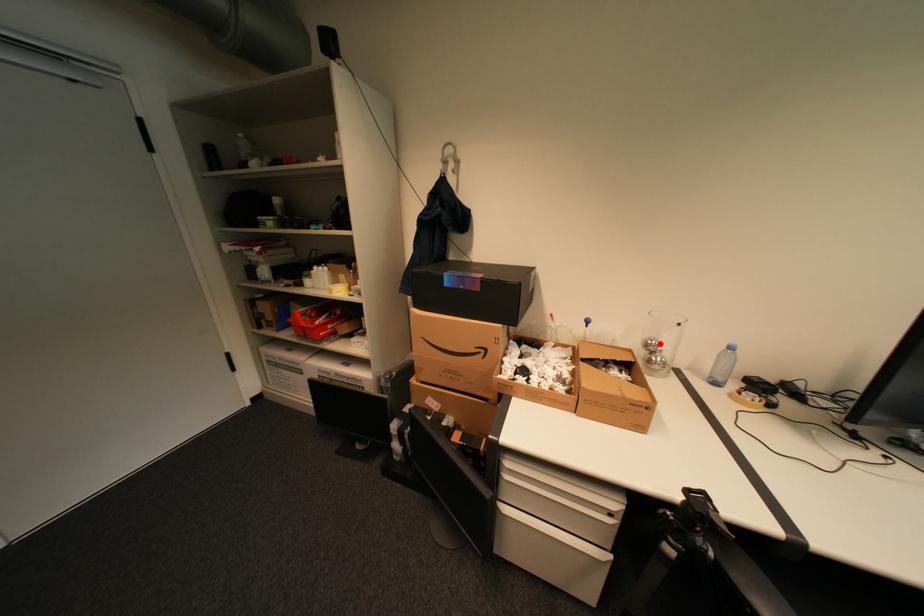
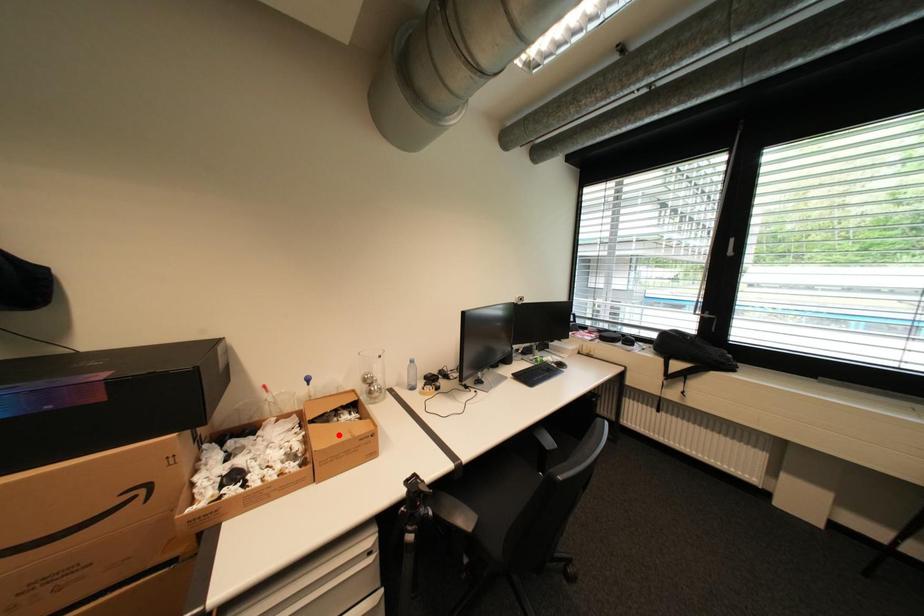
I am providing you with two images of the same scene from different viewpoints. A red point is marked on the first image and another point is marked on the second image. Is the red point in image1 aligned with the point shown in image2?

No